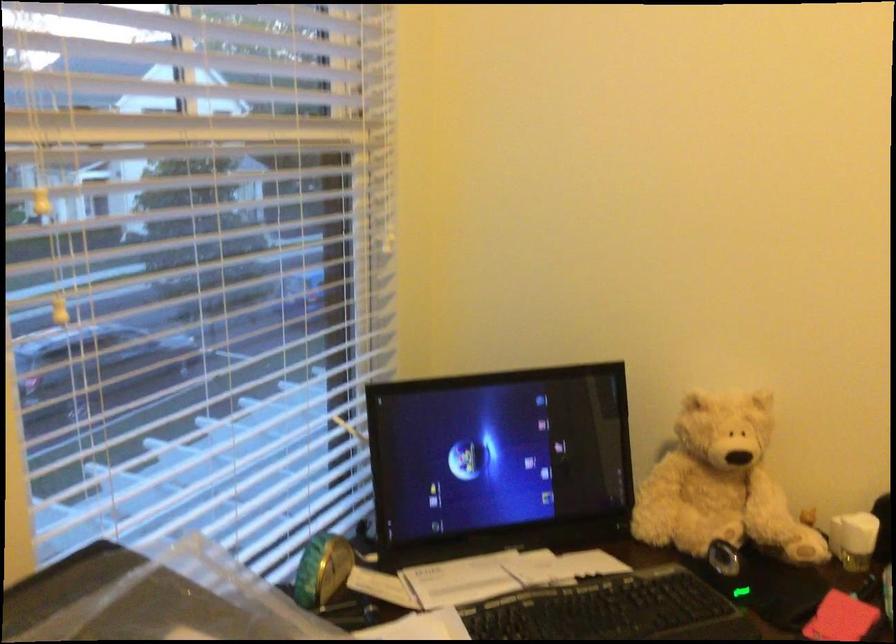
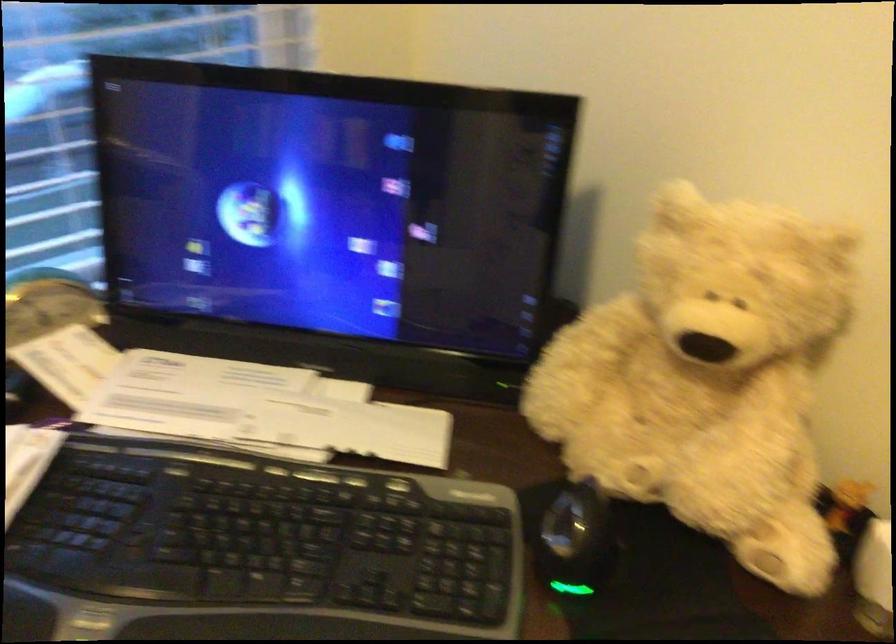
The images are taken continuously from a first-person perspective. In which direction is your viewpoint rotating?

The camera rotated toward left-down.